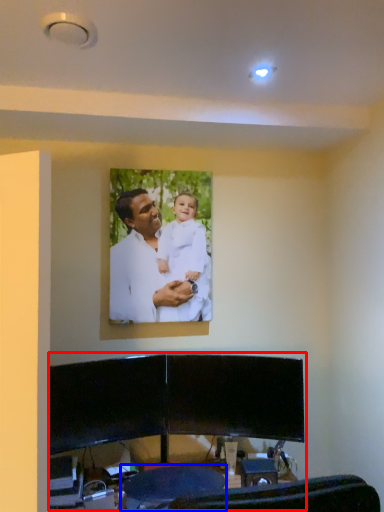
Question: Among these objects, which one is farthest to the camera, entertainment center (highlighted by a red box) or swivel chair (highlighted by a blue box)?

Choices:
 (A) entertainment center
 (B) swivel chair

Answer: (B)